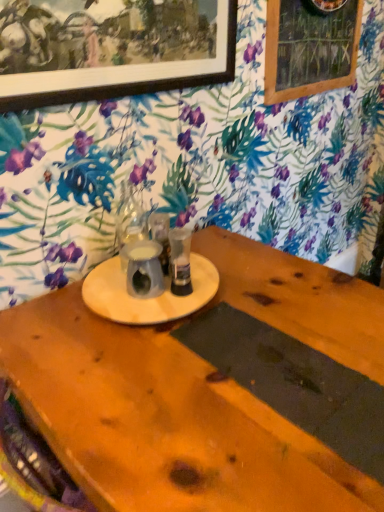
Locate an element on the screen. dark gray matte placemat at bottom center is located at coordinates (295, 383).

Which of these two, translucent glass vase at center, placed as the 1th tableware when sorted from left to right, or dark gray matte placemat at bottom center, is wider?

Wider between the two is dark gray matte placemat at bottom center.

Is point (119, 219) in front of point (371, 426)?

No, (119, 219) is further to viewer.

Visually, is translucent glass vase at center, the second tableware from the right, positioned to the left or to the right of dark gray matte placemat at bottom center?

In the image, translucent glass vase at center, the second tableware from the right, appears on the left side of dark gray matte placemat at bottom center.

From the image's perspective, between translucent glass vase at center, placed as the 1th tableware when sorted from left to right, and dark gray matte placemat at bottom center, who is located below?

dark gray matte placemat at bottom center appears lower in the image.

Is wooden picture frame at upper left further to the viewer compared to wooden frame at upper right?

No, it is not.

Who is taller, wooden picture frame at upper left or wooden frame at upper right?

wooden frame at upper right is taller.

Which object is positioned more to the left, wooden picture frame at upper left or wooden frame at upper right?

wooden picture frame at upper left.

Do you think wooden picture frame at upper left is within wooden frame at upper right, or outside of it?

wooden picture frame at upper left cannot be found inside wooden frame at upper right.

Is wooden picture frame at upper left facing towards metallic silver cup at center, acting as the 2th tableware starting from the left?

No, wooden picture frame at upper left is not facing towards metallic silver cup at center, acting as the 2th tableware starting from the left.

Is point (148, 64) positioned behind point (161, 221)?

No, (148, 64) is closer to viewer.

Considering the sizes of objects wooden picture frame at upper left and metallic silver cup at center, the 1th tableware from the right, in the image provided, who is smaller, wooden picture frame at upper left or metallic silver cup at center, the 1th tableware from the right,?

Smaller between the two is metallic silver cup at center, the 1th tableware from the right.

From a real-world perspective, does metallic silver cup at center, acting as the 2th tableware starting from the left, sit lower than translucent glass vase at center, the second tableware from the right?

Yes, from a real-world perspective, metallic silver cup at center, acting as the 2th tableware starting from the left, is below translucent glass vase at center, the second tableware from the right.

Is point (154, 217) closer or farther from the camera than point (133, 197)?

Point (154, 217) appears to be farther away from the viewer than point (133, 197).

Is the depth of metallic silver cup at center, acting as the 2th tableware starting from the left, greater than that of translucent glass vase at center, placed as the 1th tableware when sorted from left to right?

That is True.

Between metallic silver cup at center, acting as the 2th tableware starting from the left, and translucent glass vase at center, placed as the 1th tableware when sorted from left to right, which one has larger size?

With larger size is translucent glass vase at center, placed as the 1th tableware when sorted from left to right.

Is point (143, 223) in front of point (294, 25)?

Yes, point (143, 223) is closer to viewer.

Is translucent glass vase at center, the second tableware from the right, turned away from wooden frame at upper right?

No, translucent glass vase at center, the second tableware from the right, is not facing the opposite direction of wooden frame at upper right.

From a real-world perspective, which object stands above the other?

In real-world perspective, wooden frame at upper right is above.

Considering the sizes of translucent glass vase at center, the second tableware from the right, and wooden frame at upper right in the image, is translucent glass vase at center, the second tableware from the right, bigger or smaller than wooden frame at upper right?

translucent glass vase at center, the second tableware from the right, is smaller than wooden frame at upper right.

Which object is closer to the camera, wooden frame at upper right or dark gray matte placemat at bottom center?

dark gray matte placemat at bottom center is in front.

Image resolution: width=384 pixels, height=512 pixels. In order to click on plank below the wooden frame at upper right (from a real-world perspective) in this screenshot , I will do `click(295, 383)`.

Looking at their sizes, would you say wooden frame at upper right is wider or thinner than dark gray matte placemat at bottom center?

Considering their sizes, wooden frame at upper right looks slimmer than dark gray matte placemat at bottom center.

Could dark gray matte placemat at bottom center be considered to be inside wooden frame at upper right?

No, dark gray matte placemat at bottom center is not inside wooden frame at upper right.

At what (x,y) coordinates should I click in order to perform the action: click on the 2nd tableware behind when counting from the dark gray matte placemat at bottom center. Please return your answer as a coordinate pair (x, y). The width and height of the screenshot is (384, 512). Looking at the image, I should click on (161, 236).

Consider the image. Is dark gray matte placemat at bottom center taller or shorter than metallic silver cup at center, acting as the 2th tableware starting from the left?

In the image, dark gray matte placemat at bottom center appears to be shorter than metallic silver cup at center, acting as the 2th tableware starting from the left.

Is point (292, 381) farther from viewer compared to point (159, 236)?

No, (292, 381) is closer to viewer.

From a real-world perspective, which object rests below the other?

From a 3D spatial view, dark gray matte placemat at bottom center is below.

Where is `plank that appears below the translucent glass vase at center, the second tableware from the right (from a real-world perspective)`? This screenshot has height=512, width=384. plank that appears below the translucent glass vase at center, the second tableware from the right (from a real-world perspective) is located at coordinates (295, 383).

Locate an element on the screen. The image size is (384, 512). picture frame in front of the wooden frame at upper right is located at coordinates (111, 48).

Based on their spatial positions, is metallic silver cup at center, the 1th tableware from the right, or wooden frame at upper right closer to dark gray matte placemat at bottom center?

Based on the image, metallic silver cup at center, the 1th tableware from the right, appears to be nearer to dark gray matte placemat at bottom center.

Considering their positions, is dark gray matte placemat at bottom center positioned closer to wooden frame at upper right than translucent glass vase at center, placed as the 1th tableware when sorted from left to right?

translucent glass vase at center, placed as the 1th tableware when sorted from left to right.

Estimate the real-world distances between objects in this image. Which object is further from dark gray matte placemat at bottom center, translucent glass vase at center, the second tableware from the right, or wooden picture frame at upper left?

wooden picture frame at upper left is positioned further to the anchor dark gray matte placemat at bottom center.

From the image, which object appears to be nearer to wooden picture frame at upper left, translucent glass vase at center, placed as the 1th tableware when sorted from left to right, or dark gray matte placemat at bottom center?

Based on the image, translucent glass vase at center, placed as the 1th tableware when sorted from left to right, appears to be nearer to wooden picture frame at upper left.

Which object lies nearer to the anchor point dark gray matte placemat at bottom center, wooden picture frame at upper left or wooden frame at upper right?

wooden picture frame at upper left is positioned closer to the anchor dark gray matte placemat at bottom center.

Based on their spatial positions, is dark gray matte placemat at bottom center or wooden frame at upper right closer to translucent glass vase at center, placed as the 1th tableware when sorted from left to right?

Among the two, dark gray matte placemat at bottom center is located nearer to translucent glass vase at center, placed as the 1th tableware when sorted from left to right.

From the image, which object appears to be nearer to wooden picture frame at upper left, dark gray matte placemat at bottom center or translucent glass vase at center, placed as the 1th tableware when sorted from left to right?

translucent glass vase at center, placed as the 1th tableware when sorted from left to right, is closer to wooden picture frame at upper left.

Based on their spatial positions, is wooden frame at upper right or dark gray matte placemat at bottom center further from translucent glass vase at center, placed as the 1th tableware when sorted from left to right?

Based on the image, wooden frame at upper right appears to be further to translucent glass vase at center, placed as the 1th tableware when sorted from left to right.

Where is `picture frame between wooden frame at upper right and dark gray matte placemat at bottom center in the up-down direction`? This screenshot has width=384, height=512. picture frame between wooden frame at upper right and dark gray matte placemat at bottom center in the up-down direction is located at coordinates (111, 48).

Find the location of a particular element. The image size is (384, 512). tableware between wooden picture frame at upper left and metallic silver cup at center, the 1th tableware from the right, vertically is located at coordinates (130, 218).

What are the coordinates of `picture frame between wooden frame at upper right and metallic silver cup at center, acting as the 2th tableware starting from the left, in the vertical direction` in the screenshot? It's located at (111, 48).

Locate an element on the screen. picture frame between translucent glass vase at center, the second tableware from the right, and wooden frame at upper right from left to right is located at coordinates (111, 48).